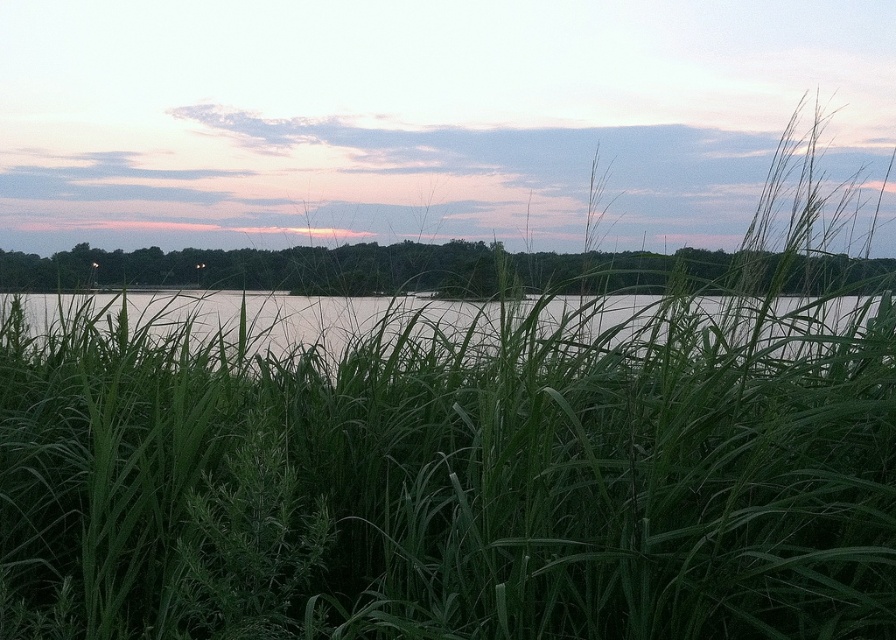
Question: Does green grass at center appear on the right side of clear water at center?

Choices:
 (A) yes
 (B) no

Answer: (A)

Question: Is green grass at center below clear water at center?

Choices:
 (A) no
 (B) yes

Answer: (A)

Question: Which point is closer to the camera?

Choices:
 (A) green grass at center
 (B) clear water at center

Answer: (A)

Question: Can you confirm if green grass at center is positioned to the right of clear water at center?

Choices:
 (A) no
 (B) yes

Answer: (B)

Question: Which point is closer to the camera taking this photo?

Choices:
 (A) (x=711, y=307)
 (B) (x=208, y=260)

Answer: (A)